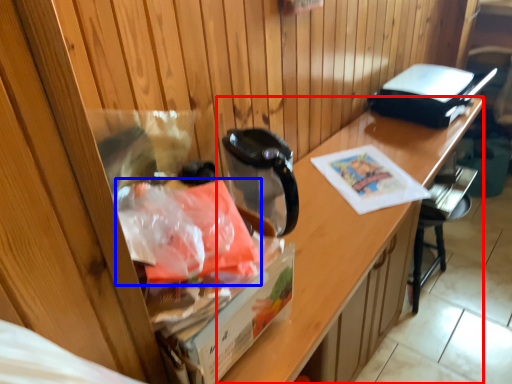
Question: Which of the following is the closest to the observer, desk (highlighted by a red box) or material (highlighted by a blue box)?

Choices:
 (A) desk
 (B) material

Answer: (B)